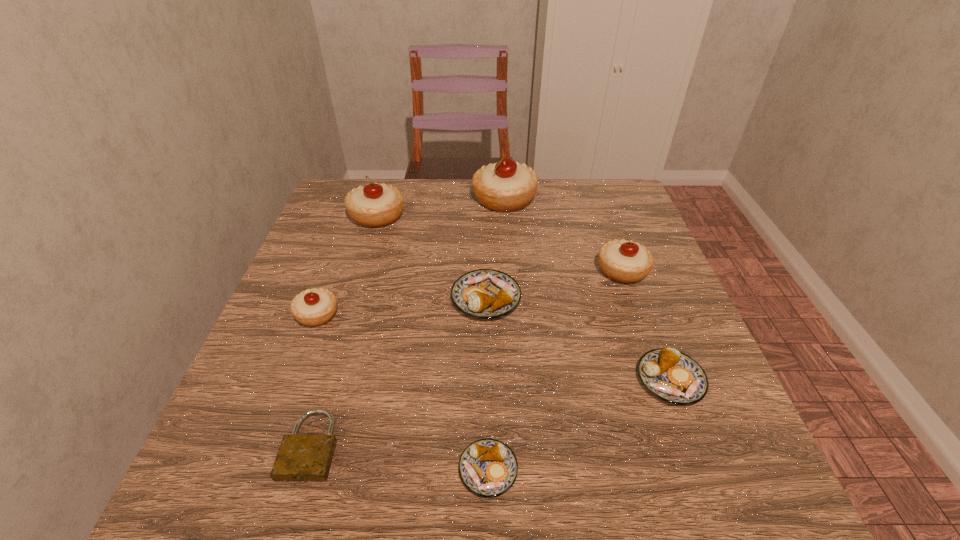
Find the location of `vacant space at the right edge`. vacant space at the right edge is located at coordinates click(671, 438).

In the image, there is a desktop. Where is `vacant space at the far left corner`? vacant space at the far left corner is located at coordinates (340, 198).

What are the coordinates of `free spot between the seventh shortest object and the biggest beige pastry` in the screenshot? It's located at (441, 207).

Locate an element on the screen. The width and height of the screenshot is (960, 540). vacant area between the padlock and the farthest brown pastry is located at coordinates (398, 372).

What are the coordinates of `unoccupied area between the biggest beige pastry and the third biggest beige pastry` in the screenshot? It's located at (564, 235).

Locate an element on the screen. The width and height of the screenshot is (960, 540). blank region between the sixth farthest pastry and the fifth tallest object is located at coordinates (578, 339).

Locate an element on the screen. The height and width of the screenshot is (540, 960). empty space between the biggest brown pastry and the second beige pastry from right to left is located at coordinates (495, 249).

Image resolution: width=960 pixels, height=540 pixels. I want to click on free space that is in between the third shortest pastry and the second tallest pastry, so click(431, 257).

I want to click on unoccupied position between the padlock and the second beige pastry from right to left, so click(408, 322).

Identify the location of free area in between the rightmost brown pastry and the farthest brown pastry. The image size is (960, 540). (578, 339).